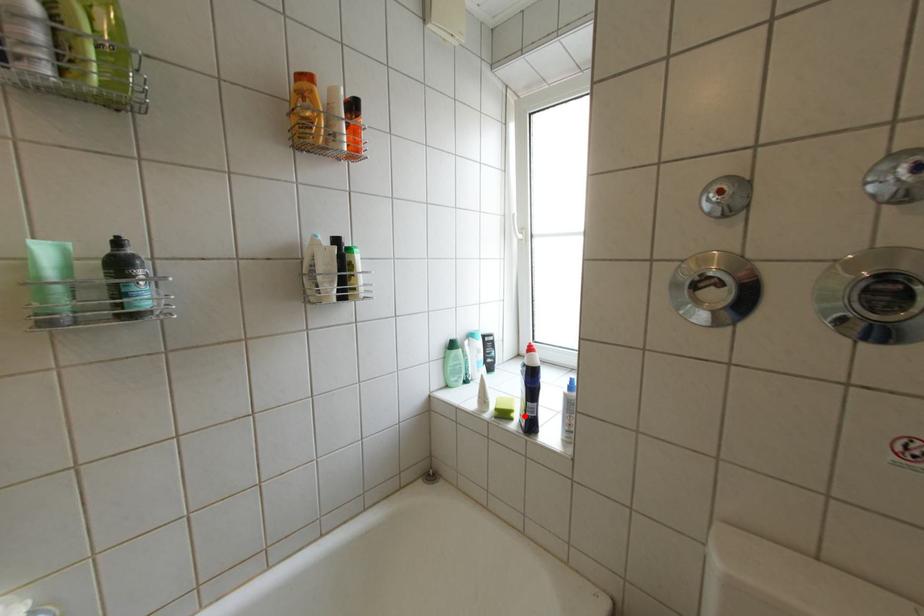
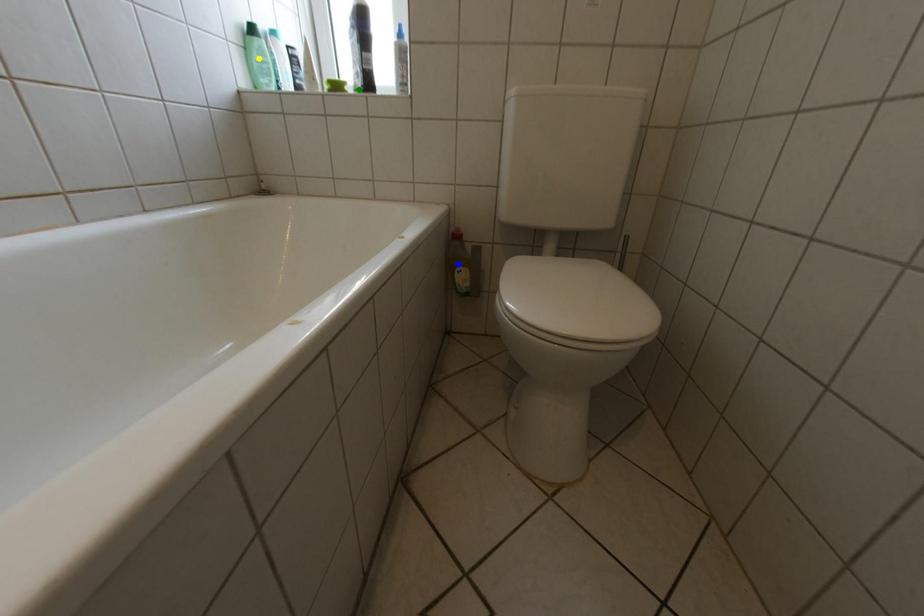
Question: I am providing you with two images of the same scene from different viewpoints. A red point is marked on the first image. You are given multiple points on the second image. Can you choose the point in image 2 that corresponds to the point in image 1?

Choices:
 (A) blue point
 (B) green point
 (C) yellow point

Answer: (B)